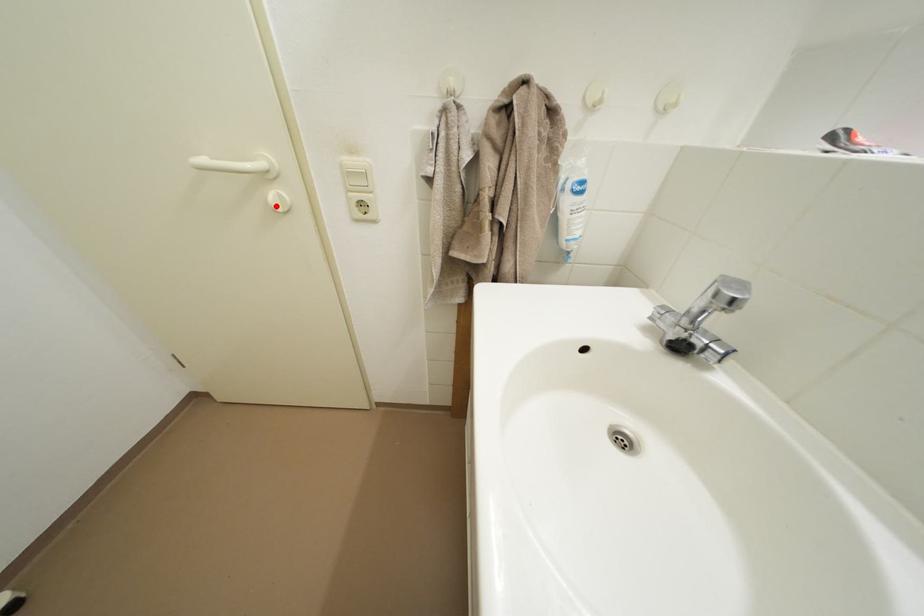
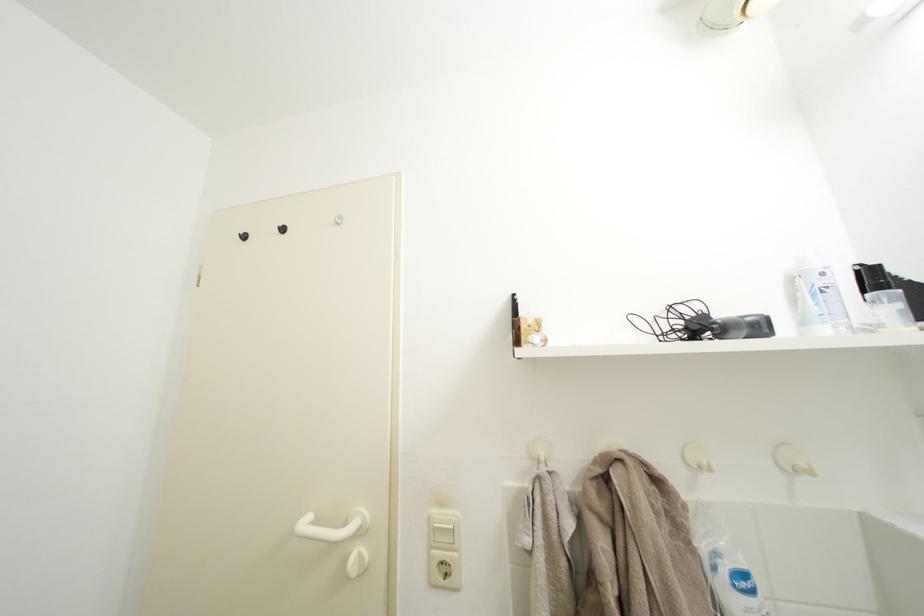
Where in the second image is the point corresponding to the highlighted location from the first image?

(354, 565)